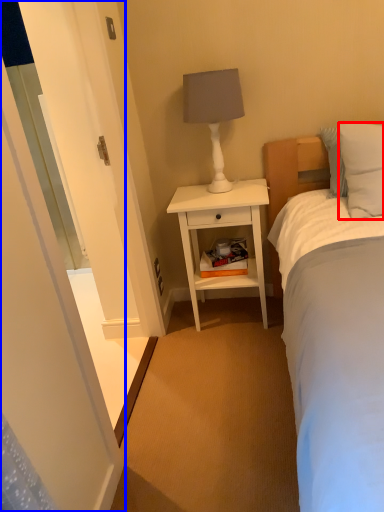
Question: Which object is closer to the camera taking this photo, pillow (highlighted by a red box) or screen door (highlighted by a blue box)?

Choices:
 (A) pillow
 (B) screen door

Answer: (B)